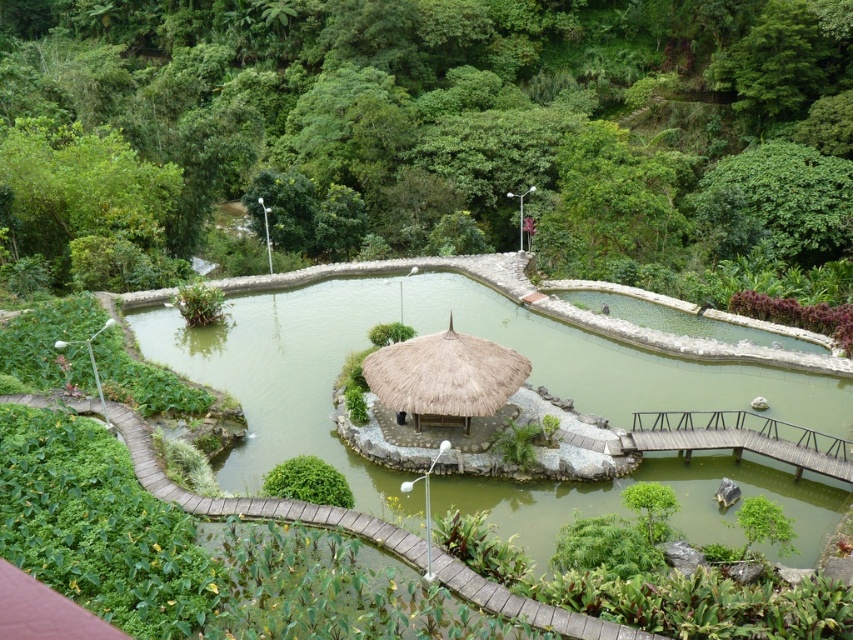
Does point (100, 205) come closer to viewer compared to point (277, 372)?

No, (100, 205) is further to viewer.

Who is higher up, green leafy tree at center or green water at center?

green leafy tree at center

This screenshot has width=853, height=640. What do you see at coordinates (434, 134) in the screenshot? I see `green leafy tree at center` at bounding box center [434, 134].

The width and height of the screenshot is (853, 640). I want to click on green leafy tree at center, so click(434, 134).

Who is positioned more to the left, green water at center or wooden bridge at lower right?

Positioned to the left is green water at center.

Does green water at center have a lesser height compared to wooden bridge at lower right?

No, green water at center is not shorter than wooden bridge at lower right.

Is point (239, 449) farther from camera compared to point (842, 438)?

Yes, point (239, 449) is behind point (842, 438).

Where is `green water at center`? The height and width of the screenshot is (640, 853). green water at center is located at coordinates (281, 372).

Does green leafy tree at center appear over wooden bridge at lower right?

Yes.

Can you confirm if green leafy tree at center is thinner than wooden bridge at lower right?

In fact, green leafy tree at center might be wider than wooden bridge at lower right.

The width and height of the screenshot is (853, 640). In order to click on green leafy tree at center in this screenshot , I will do `click(434, 134)`.